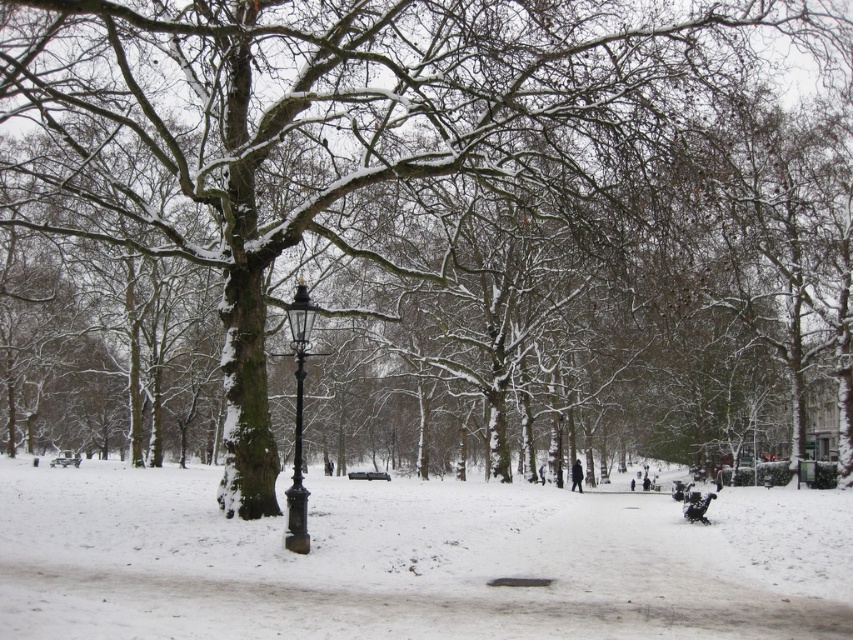
You are an artist planning to paint this winter scene. You want to ensure the black wrought iron lamp post at center is proportionally accurate compared to the white powdery snow at center. Based on the scene, which object should appear larger in your painting?

The white powdery snow at center should appear larger in the painting since it is described as bigger than the black wrought iron lamp post at center.

You are a snowman builder and want to use the white powdery snow at center to build a snowman next to the black wrought iron lamp post at center. Since the snowman must be taller than the lamp post, is there enough snow available?

The white powdery snow at center is shorter than the black wrought iron lamp post at center, so there isn not enough snow to build a snowman taller than the lamp post.

You are standing in the winter park scene and want to take a photo. There are two points marked in the image, point A at coordinates point (206, 636) and point B at coordinates point (306, 332). Which point would appear larger in your photo?

Point A at coordinates point (206, 636) appears larger in the photo because it is closer to the camera than point B at coordinates point (306, 332).